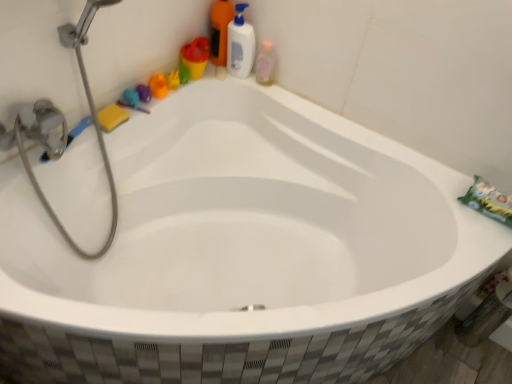
Question: Is rubber duck at upper left, which is the second toy from left to right, in contact with matte plastic cup at upper left?

Choices:
 (A) yes
 (B) no

Answer: (B)

Question: From the image's perspective, is rubber duck at upper left, the 2th toy in the right-to-left sequence, over matte plastic cup at upper left?

Choices:
 (A) no
 (B) yes

Answer: (A)

Question: Is the depth of rubber duck at upper left, the 2th toy in the right-to-left sequence, greater than that of matte plastic cup at upper left?

Choices:
 (A) yes
 (B) no

Answer: (B)

Question: From a real-world perspective, is rubber duck at upper left, the 2th toy in the right-to-left sequence, positioned over matte plastic cup at upper left based on gravity?

Choices:
 (A) no
 (B) yes

Answer: (A)

Question: Does rubber duck at upper left, which is the second toy from left to right, have a smaller size compared to matte plastic cup at upper left?

Choices:
 (A) yes
 (B) no

Answer: (A)

Question: Is rubber duck at upper left, which is the second toy from left to right, completely or partially outside of matte plastic cup at upper left?

Choices:
 (A) no
 (B) yes

Answer: (B)

Question: From a real-world perspective, is rubber duck at upper left, which is the second toy from left to right, on yellow sponge at upper left?

Choices:
 (A) no
 (B) yes

Answer: (B)

Question: Is rubber duck at upper left, which is the second toy from left to right, positioned beyond the bounds of yellow sponge at upper left?

Choices:
 (A) no
 (B) yes

Answer: (B)

Question: Is rubber duck at upper left, the 2th toy in the right-to-left sequence, oriented away from yellow sponge at upper left?

Choices:
 (A) yes
 (B) no

Answer: (B)

Question: From a real-world perspective, is rubber duck at upper left, which is the second toy from left to right, beneath yellow sponge at upper left?

Choices:
 (A) no
 (B) yes

Answer: (A)

Question: Would you say yellow sponge at upper left is part of rubber duck at upper left, the 2th toy in the right-to-left sequence,'s contents?

Choices:
 (A) no
 (B) yes

Answer: (A)

Question: Is rubber duck at upper left, which is the second toy from left to right, placed right next to yellow sponge at upper left?

Choices:
 (A) yes
 (B) no

Answer: (B)

Question: From the image's perspective, is rubber duck at upper left, placed as the third toy when sorted from right to left, located beneath rubber duck at upper left, which is the second toy from left to right?

Choices:
 (A) no
 (B) yes

Answer: (B)